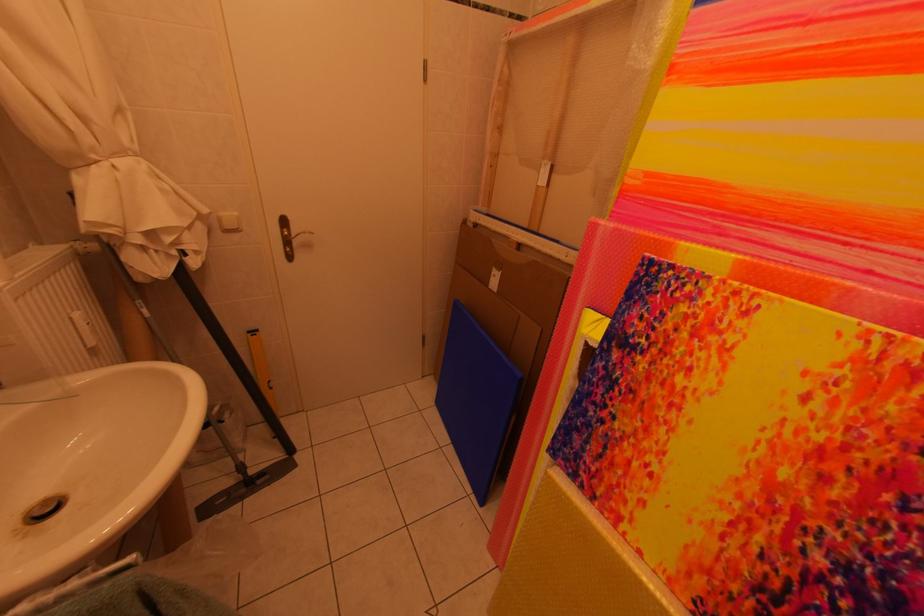
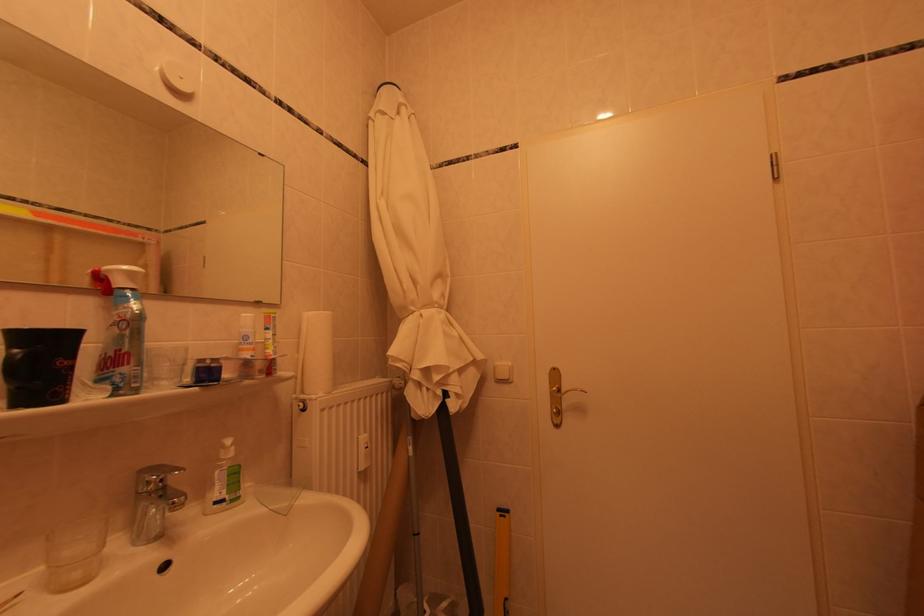
Where in the second image is the point corresponding to point (302, 238) from the first image?

(572, 395)